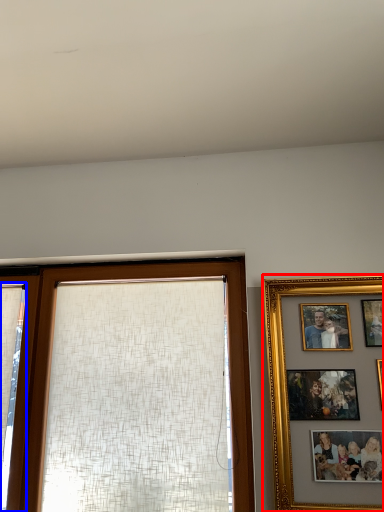
Question: Which object appears farthest to the camera in this image, picture frame (highlighted by a red box) or curtain (highlighted by a blue box)?

Choices:
 (A) picture frame
 (B) curtain

Answer: (B)